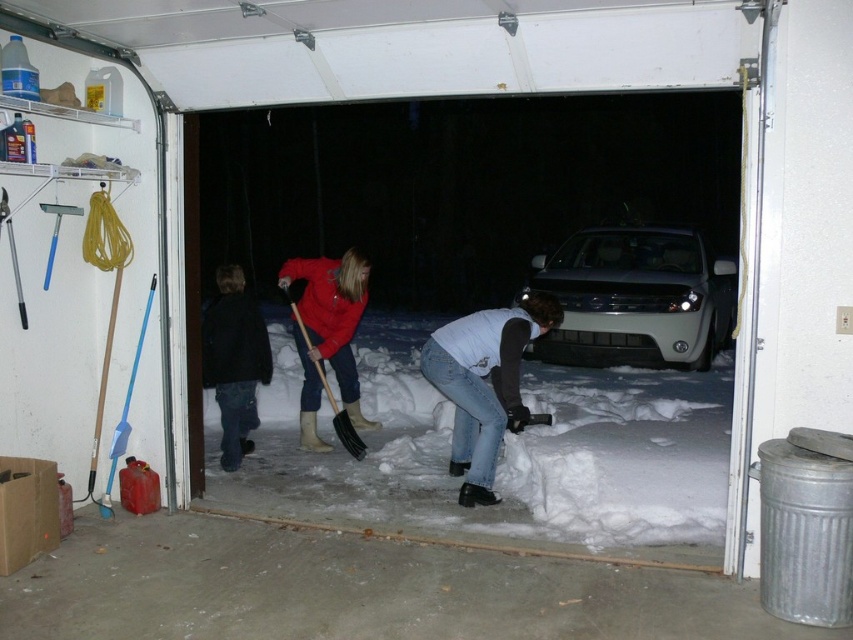
You are standing in the garage and need to reach both the point at coordinates point (x=482, y=381) and point (x=115, y=442). Which point should you approach first to reach the one that is closer to you?

Point (x=115, y=442) is closer to you, so you should approach it first.

Based on the photo, you are standing in the garage and want to reach the red gas canister near the bottom left corner. There is white fluffy snow at center and blue plastic shovel at left in your way. Which object should you move first to clear the path?

The white fluffy snow at center is in front of the blue plastic shovel at left, so you should move the blue plastic shovel at left first to access the red gas canister.